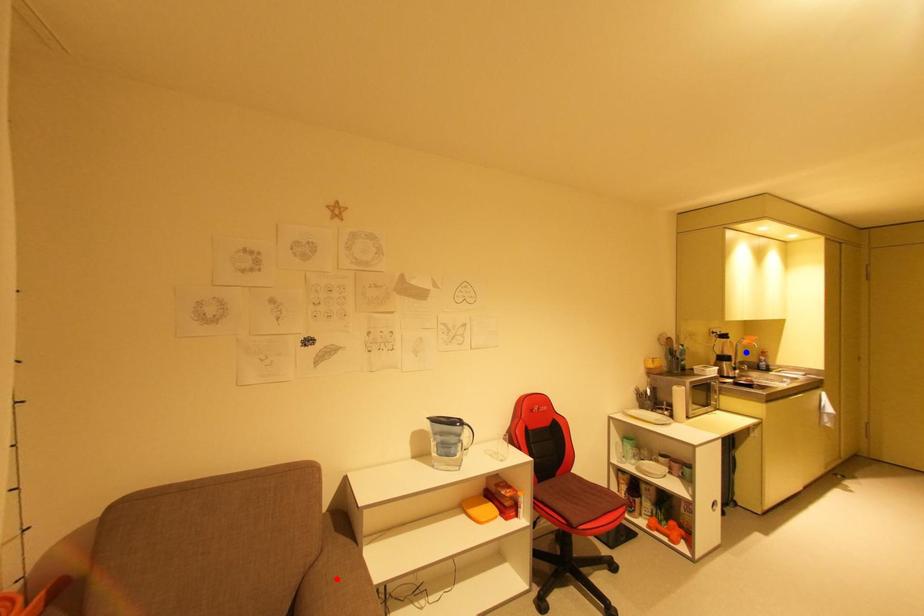
Question: Which of the two points in the image is closer to the camera?

Choices:
 (A) Blue point is closer.
 (B) Red point is closer.

Answer: (B)